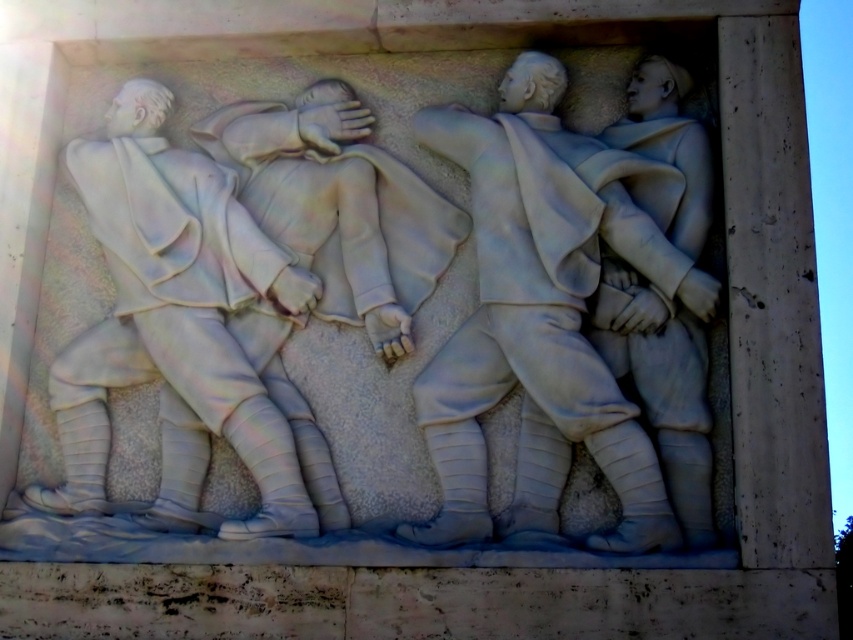
You are an art conservator examining the stone relief sculpture. You notice that the white marble figure at center and the white marble figure at left are positioned in a way that might affect their structural stability. Based on their spatial relationship, which figure is at a higher elevation and thus more prone to water runoff damage?

The white marble figure at center is located above the white marble figure at left, so it is at a higher elevation and therefore more prone to water runoff damage.

You are an art conservator examining the stone relief sculpture. You notice the white marble figure at center and the white marble figure at left. Which figure is larger in size?

The white marble figure at left is larger than the white marble figure at center.